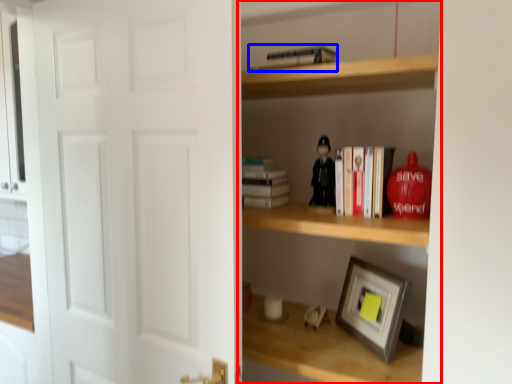
Question: Which object is closer to the camera taking this photo, shelf (highlighted by a red box) or book (highlighted by a blue box)?

Choices:
 (A) shelf
 (B) book

Answer: (A)